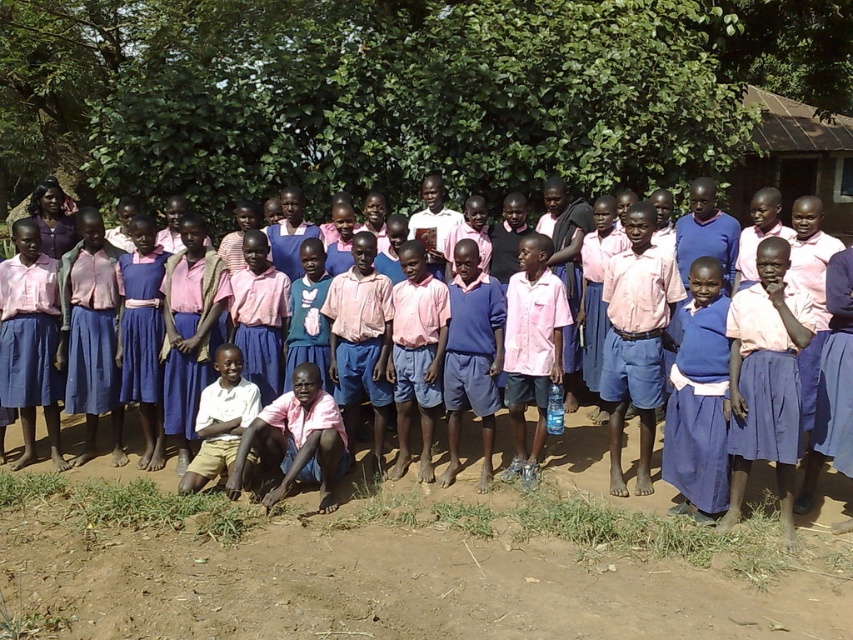
You are a photographer trying to capture a clear shot of the pink fabric shirt at center and the brown soil at lower center. Which object is wider in the image?

The brown soil at lower center might be wider than the pink fabric shirt at center according to the description.

From the picture: You are a photographer taking a group photo of the children. You notice the brown soil at lower center and the pink fabric shirt at center. Which object is positioned to the left of the other?

The brown soil at lower center is to the left of the pink fabric shirt at center.

You are a photographer standing at the camera position. You want to place a small flag exactly 3 meters in front of you to mark the spot for the next photo. Will the flag be placed on the brown soil at lower center or somewhere else?

The brown soil at lower center is 4.00 meters away from the camera, so placing a flag 3 meters in front would be 1 meter closer to the camera than the brown soil at lower center. Therefore, the flag will be placed somewhere else closer to you.